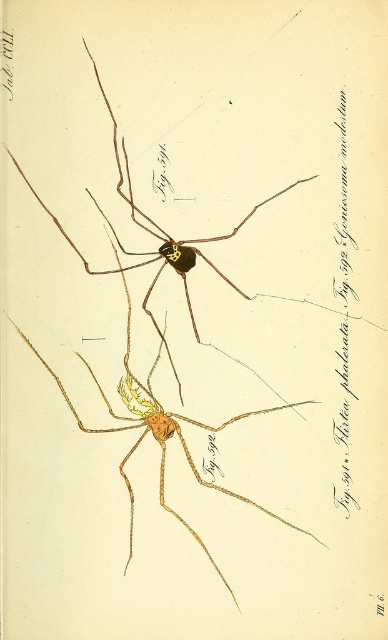
Question: Which object is closer to the camera taking this photo?

Choices:
 (A) black paper text at right
 (B) golden-brown matte spider at bottom left
 (C) brown matte spider at center

Answer: (B)

Question: Which object is the closest to the brown matte spider at center?

Choices:
 (A) black paper text at right
 (B) golden-brown matte spider at bottom left

Answer: (B)

Question: Is brown matte spider at center below black paper text at right?

Choices:
 (A) no
 (B) yes

Answer: (A)

Question: Does brown matte spider at center have a larger size compared to black paper text at right?

Choices:
 (A) yes
 (B) no

Answer: (A)

Question: Among these objects, which one is nearest to the camera?

Choices:
 (A) golden-brown matte spider at bottom left
 (B) brown matte spider at center
 (C) black paper text at right

Answer: (A)

Question: In this image, where is golden-brown matte spider at bottom left located relative to brown matte spider at center?

Choices:
 (A) above
 (B) below

Answer: (B)